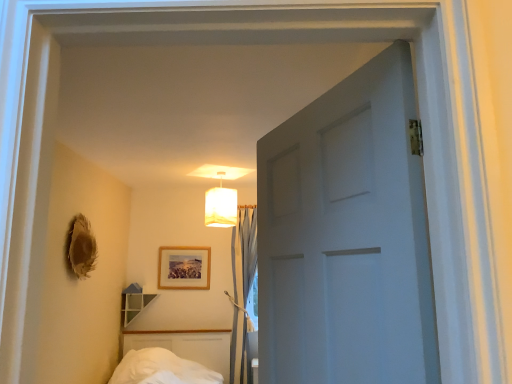
Question: Would you say light blue fabric curtain at center is a long distance from white fabric lampshade at upper center?

Choices:
 (A) no
 (B) yes

Answer: (A)

Question: Considering the relative sizes of light blue fabric curtain at center and white fabric lampshade at upper center in the image provided, is light blue fabric curtain at center smaller than white fabric lampshade at upper center?

Choices:
 (A) yes
 (B) no

Answer: (B)

Question: Is light blue fabric curtain at center taller than white fabric lampshade at upper center?

Choices:
 (A) yes
 (B) no

Answer: (A)

Question: Considering the relative positions of light blue fabric curtain at center and white fabric lampshade at upper center in the image provided, is light blue fabric curtain at center behind white fabric lampshade at upper center?

Choices:
 (A) yes
 (B) no

Answer: (A)

Question: Does light blue fabric curtain at center have a lesser height compared to white fabric lampshade at upper center?

Choices:
 (A) yes
 (B) no

Answer: (B)

Question: From the image's perspective, is wooden picture frame at center positioned above or below light blue fabric curtain at center?

Choices:
 (A) above
 (B) below

Answer: (A)

Question: Looking at their shapes, would you say wooden picture frame at center is wider or thinner than light blue fabric curtain at center?

Choices:
 (A) thin
 (B) wide

Answer: (A)

Question: From a real-world perspective, is wooden picture frame at center above or below light blue fabric curtain at center?

Choices:
 (A) above
 (B) below

Answer: (A)

Question: Considering the positions of point (174, 283) and point (238, 299), is point (174, 283) closer or farther from the camera than point (238, 299)?

Choices:
 (A) closer
 (B) farther

Answer: (B)

Question: Is point (244, 253) closer or farther from the camera than point (175, 288)?

Choices:
 (A) closer
 (B) farther

Answer: (B)

Question: Is light blue fabric curtain at center bigger or smaller than wooden picture frame at center?

Choices:
 (A) big
 (B) small

Answer: (A)

Question: Is light blue fabric curtain at center wider or thinner than wooden picture frame at center?

Choices:
 (A) thin
 (B) wide

Answer: (B)

Question: From a real-world perspective, relative to wooden picture frame at center, is light blue fabric curtain at center vertically above or below?

Choices:
 (A) below
 (B) above

Answer: (A)

Question: Is light blue fabric curtain at center bigger or smaller than white fabric lampshade at upper center?

Choices:
 (A) small
 (B) big

Answer: (B)

Question: Based on their positions, is light blue fabric curtain at center located to the left or right of white fabric lampshade at upper center?

Choices:
 (A) left
 (B) right

Answer: (B)